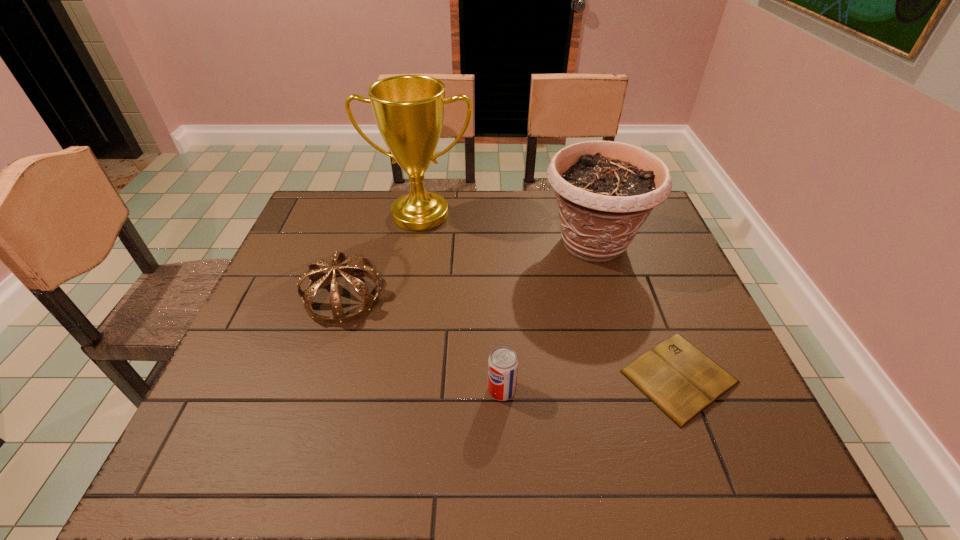
Locate an element on the screen. vacant area that lies between the book and the third shortest object is located at coordinates (511, 337).

Identify the location of free space between the book and the award. This screenshot has width=960, height=540. (550, 296).

Select which object is the closest to the book. Please provide its 2D coordinates. Your answer should be formatted as a tuple, i.e. [(x, y)], where the tuple contains the x and y coordinates of a point satisfying the conditions above.

[(605, 190)]

Locate an element on the screen. The image size is (960, 540). object that can be found as the fourth closest to the tiara is located at coordinates (682, 381).

This screenshot has width=960, height=540. In order to click on vacant position in the image that satisfies the following two spatial constraints: 1. on the front side of the fourth tallest object; 2. on the left side of the third shortest object in this screenshot , I will do `click(314, 390)`.

Locate an element on the screen. The image size is (960, 540). vacant area that satisfies the following two spatial constraints: 1. by the handles of the tallest object; 2. on the left side of the shortest object is located at coordinates coord(393,376).

The height and width of the screenshot is (540, 960). I want to click on free spot that satisfies the following two spatial constraints: 1. by the handles of the award; 2. on the right side of the book, so click(x=393, y=376).

The image size is (960, 540). What are the coordinates of `free space in the image that satisfies the following two spatial constraints: 1. by the handles of the second tallest object; 2. on the left side of the award` in the screenshot? It's located at (416, 244).

Locate an element on the screen. This screenshot has width=960, height=540. free space that satisfies the following two spatial constraints: 1. by the handles of the award; 2. on the left side of the fourth tallest object is located at coordinates (391, 390).